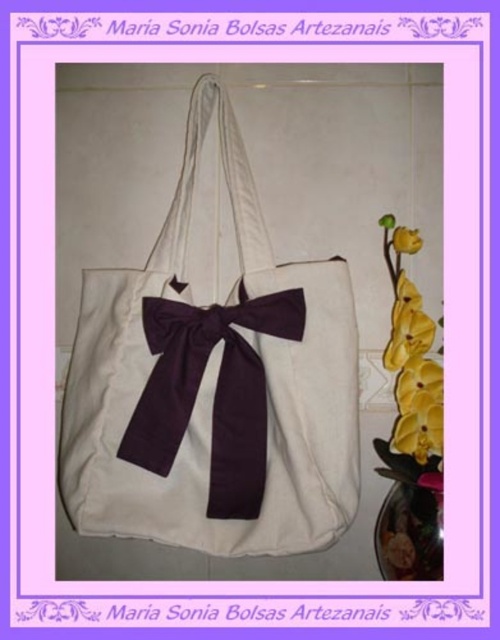
Does matte glass vase at lower right have a greater width compared to yellow matte flower at upper right?

Correct, the width of matte glass vase at lower right exceeds that of yellow matte flower at upper right.

Which is behind, point (427, 563) or point (405, 244)?

The point (405, 244) is more distant.

What are the coordinates of `matte glass vase at lower right` in the screenshot? It's located at (410, 532).

Can you confirm if yellow fabric flower at right is positioned to the right of matte glass vase at lower right?

Indeed, yellow fabric flower at right is positioned on the right side of matte glass vase at lower right.

Is point (409, 381) less distant than point (424, 502)?

No, it is not.

Where is `yellow fabric flower at right`? Image resolution: width=500 pixels, height=640 pixels. yellow fabric flower at right is located at coordinates (411, 362).

Is purple satin bow at center below yellow fabric flower at right?

Yes.

Who is higher up, purple satin bow at center or yellow fabric flower at right?

yellow fabric flower at right is above.

At what (x,y) coordinates should I click in order to perform the action: click on purple satin bow at center. Please return your answer as a coordinate pair (x, y). Looking at the image, I should click on (216, 385).